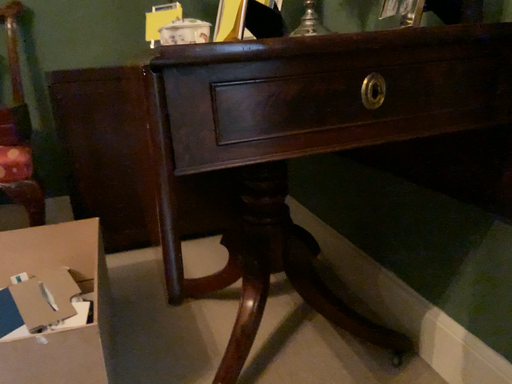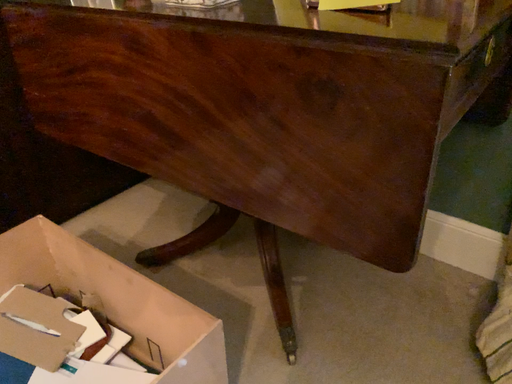
Question: Which way did the camera rotate in the video?

Choices:
 (A) rotated upward
 (B) rotated downward

Answer: (B)